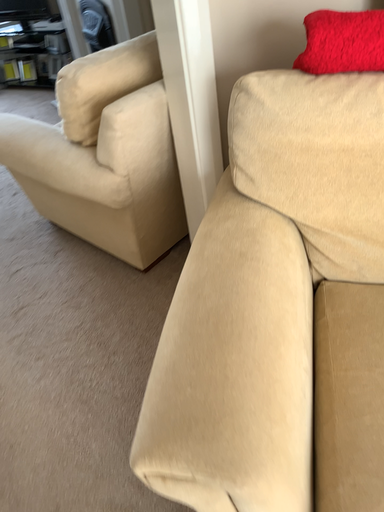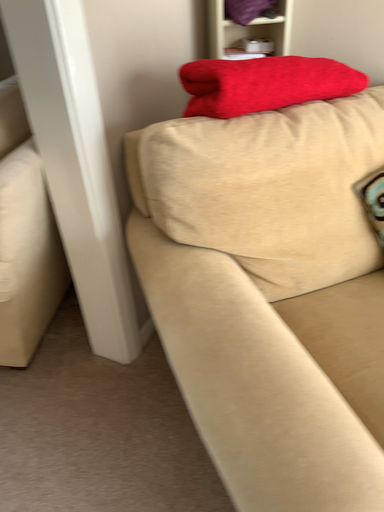
Question: How did the camera likely rotate when shooting the video?

Choices:
 (A) rotated downward
 (B) rotated upward

Answer: (B)